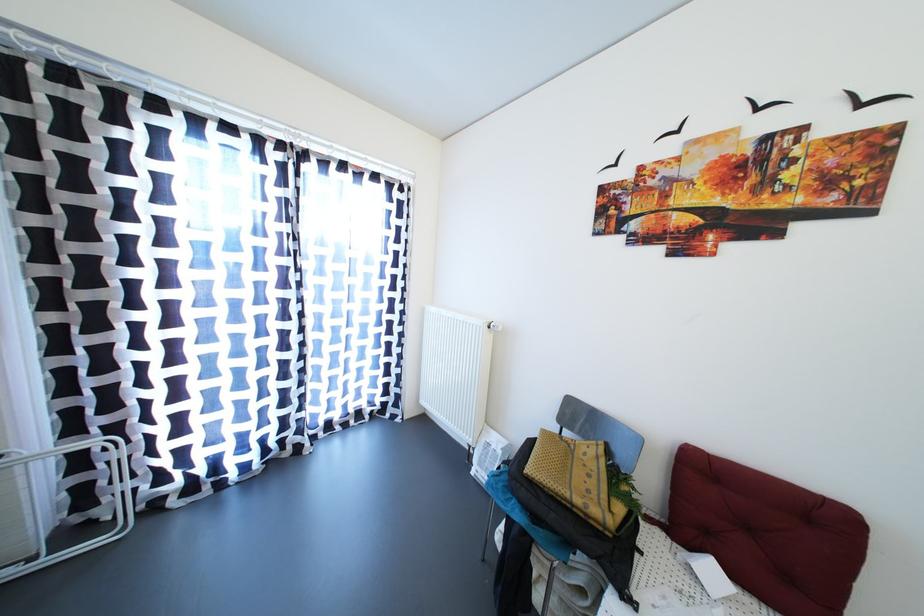
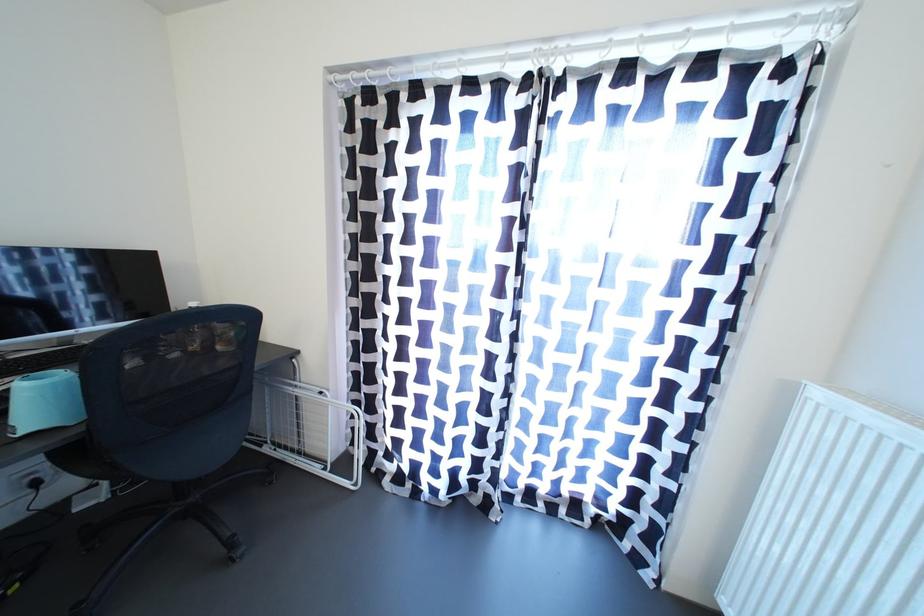
Question: The camera is either moving clockwise (left) or counter-clockwise (right) around the object. The first image is from the beginning of the video and the second image is from the end. Is the camera moving left or right when shooting the video?

Choices:
 (A) Left
 (B) Right

Answer: (B)